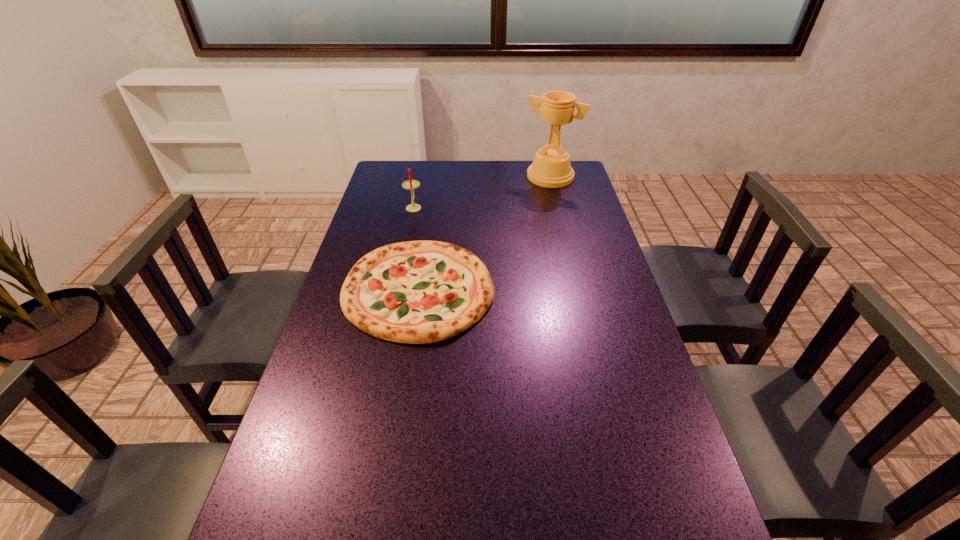
Point out which object is positioned as the nearest to the shortest object. Please provide its 2D coordinates. Your answer should be formatted as a tuple, i.e. [(x, y)], where the tuple contains the x and y coordinates of a point satisfying the conditions above.

[(410, 184)]

Find the location of a particular element. This screenshot has width=960, height=540. object that is the nearest to the farthest object is located at coordinates (417, 292).

Find the location of a particular element. The image size is (960, 540). vacant point that satisfies the following two spatial constraints: 1. on the back side of the tallest object; 2. on the left side of the second nearest object is located at coordinates (420, 177).